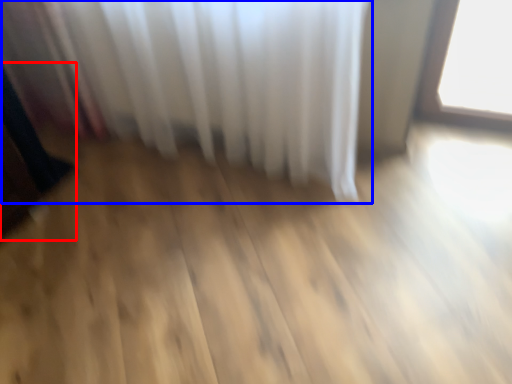
Question: Among these objects, which one is nearest to the camera, dark (highlighted by a red box) or curtain (highlighted by a blue box)?

Choices:
 (A) dark
 (B) curtain

Answer: (B)